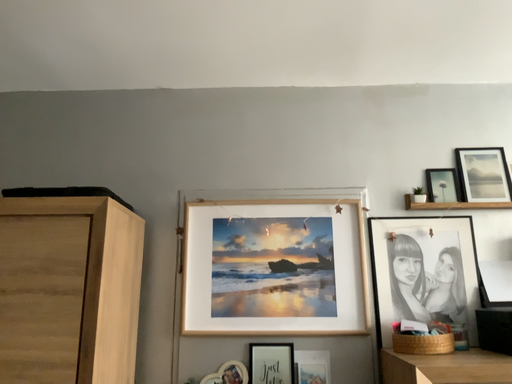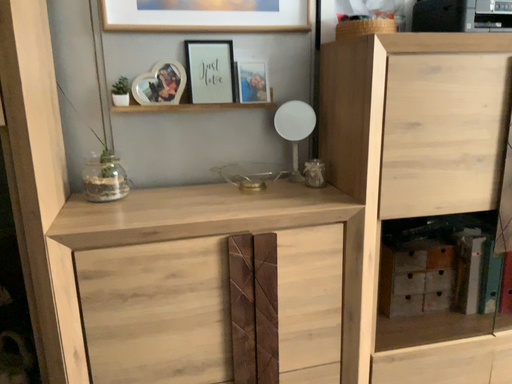
Question: Which way did the camera rotate in the video?

Choices:
 (A) rotated right
 (B) rotated left

Answer: (A)